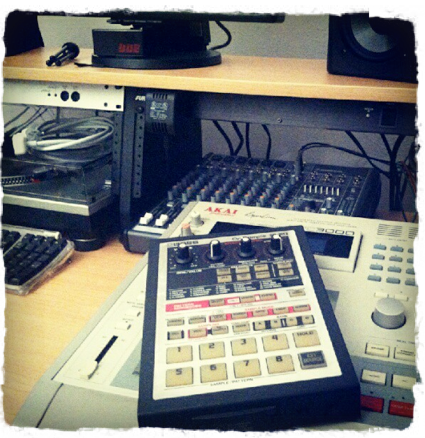
Identify the location of right side of keyboard. Image resolution: width=425 pixels, height=438 pixels. (27, 255).